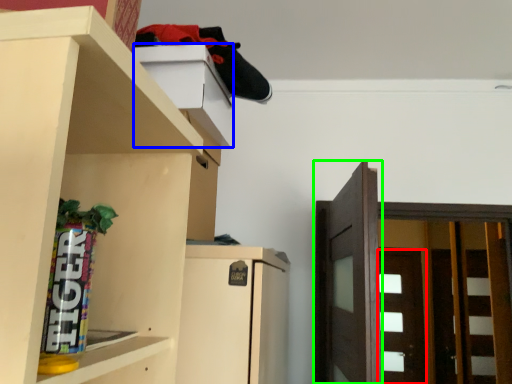
Question: Which object is the closest to the door (highlighted by a red box)? Choose among these: cabinet (highlighted by a blue box) or door (highlighted by a green box).

Choices:
 (A) cabinet
 (B) door

Answer: (B)